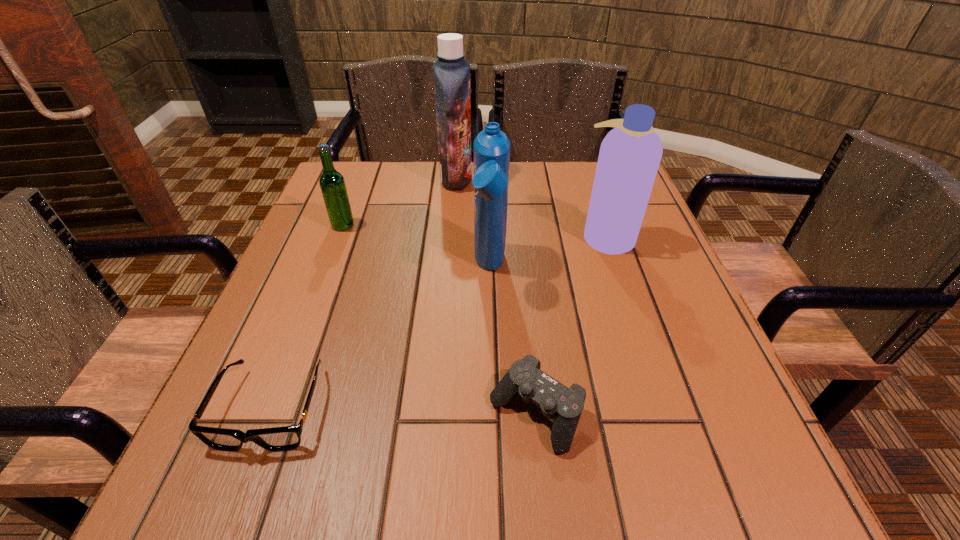
The width and height of the screenshot is (960, 540). Identify the location of free spot located 0.190m on the front of the third shortest object. (319, 289).

Find the location of a particular element. vacant area located on the left of the second shortest object is located at coordinates (252, 413).

I want to click on free region located on the front-facing side of the sunglasses, so click(233, 507).

Locate an element on the screen. object located in the far edge section of the desktop is located at coordinates (451, 72).

Find the location of a particular element. This screenshot has height=540, width=960. control located at the near edge is located at coordinates (556, 401).

The width and height of the screenshot is (960, 540). Find the location of `sunglasses that is at the near edge`. sunglasses that is at the near edge is located at coordinates (284, 438).

This screenshot has width=960, height=540. In order to click on beer bottle that is positioned at the left edge in this screenshot , I will do `click(332, 184)`.

At what (x,y) coordinates should I click in order to perform the action: click on sunglasses present at the left edge. Please return your answer as a coordinate pair (x, y). This screenshot has width=960, height=540. Looking at the image, I should click on (284, 438).

Image resolution: width=960 pixels, height=540 pixels. I want to click on object that is at the right edge, so click(630, 154).

The height and width of the screenshot is (540, 960). What are the coordinates of `object present at the near left corner` in the screenshot? It's located at (284, 438).